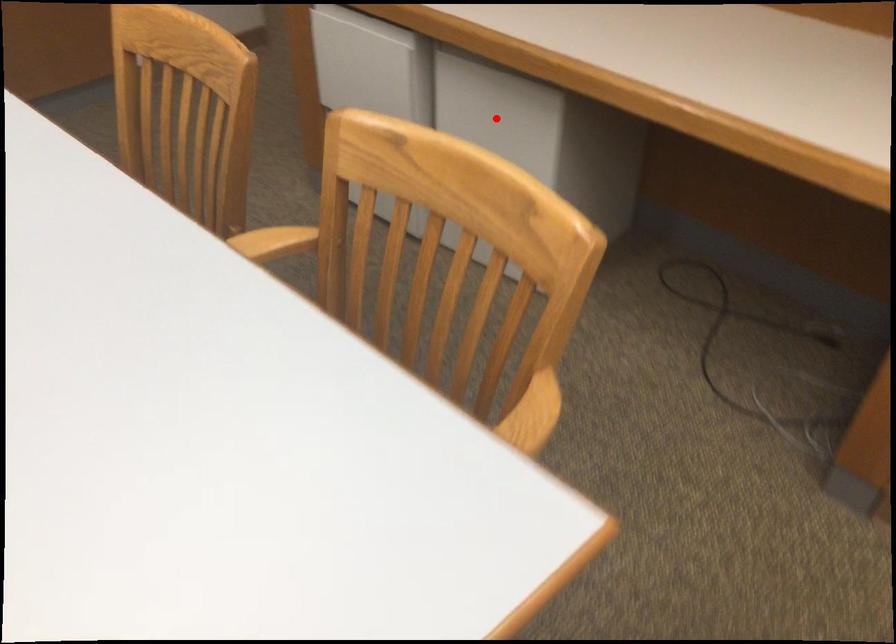
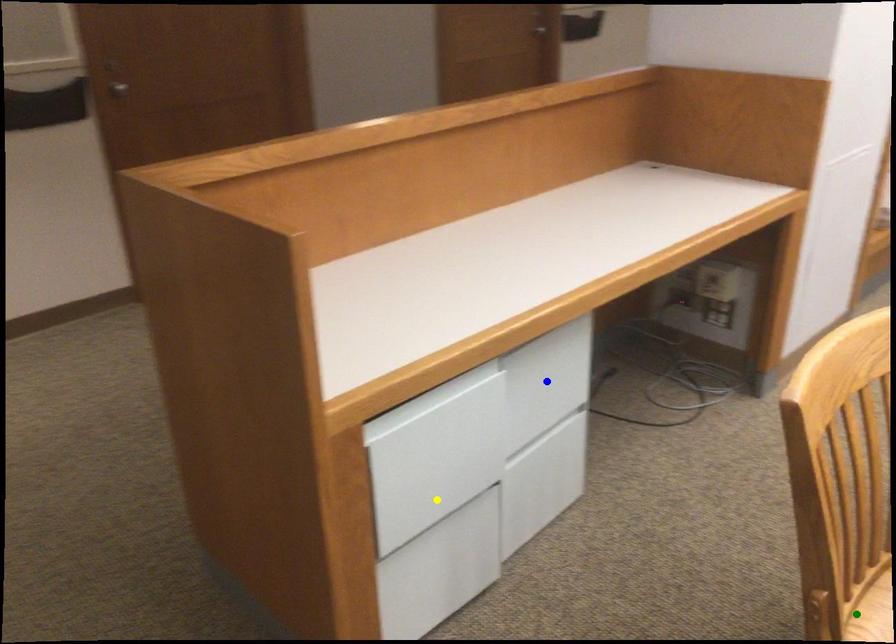
Question: I am providing you with two images of the same scene from different viewpoints. A red point is marked on the first image. You are given multiple points on the second image. Which point in image 2 represents the same 3d spot as the red point in image 1?

Choices:
 (A) green point
 (B) blue point
 (C) yellow point

Answer: (B)